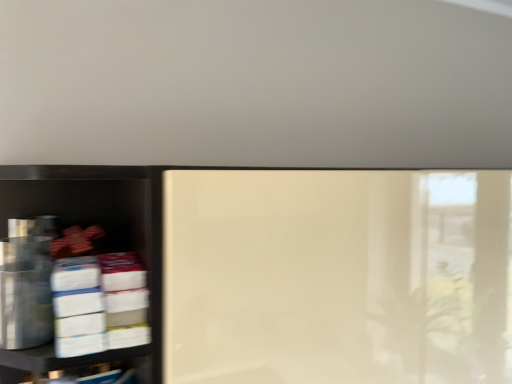
I want to click on metallic silver canisters at left, which is counted as the 1th shelf, starting from the left, so click(x=98, y=215).

Measure the distance between point (139, 195) and camera.

Point (139, 195) is 32.32 inches away from camera.

What do you see at coordinates (98, 215) in the screenshot? The height and width of the screenshot is (384, 512). I see `metallic silver canisters at left, marked as the second shelf in a right-to-left arrangement` at bounding box center [98, 215].

Describe the element at coordinates (324, 274) in the screenshot. I see `matte white shelf at center, which is the first shelf in right-to-left order` at that location.

This screenshot has width=512, height=384. Find the location of `matte white shelf at center, which is the first shelf in right-to-left order`. matte white shelf at center, which is the first shelf in right-to-left order is located at coordinates (324, 274).

The height and width of the screenshot is (384, 512). I want to click on metallic silver canisters at left, which is counted as the 1th shelf, starting from the left, so click(98, 215).

Considering the relative positions of metallic silver canisters at left, marked as the second shelf in a right-to-left arrangement, and matte white shelf at center, the second shelf positioned from the left, in the image provided, is metallic silver canisters at left, marked as the second shelf in a right-to-left arrangement, to the right of matte white shelf at center, the second shelf positioned from the left, from the viewer's perspective?

Incorrect, metallic silver canisters at left, marked as the second shelf in a right-to-left arrangement, is not on the right side of matte white shelf at center, the second shelf positioned from the left.

Is metallic silver canisters at left, which is counted as the 1th shelf, starting from the left, closer to camera compared to matte white shelf at center, which is the first shelf in right-to-left order?

Yes, metallic silver canisters at left, which is counted as the 1th shelf, starting from the left, is closer to the viewer.

Considering the points (50, 206) and (370, 277), which point is behind, point (50, 206) or point (370, 277)?

The point (50, 206) is farther.

From the image's perspective, is metallic silver canisters at left, marked as the second shelf in a right-to-left arrangement, located beneath matte white shelf at center, which is the first shelf in right-to-left order?

No.

From a real-world perspective, is metallic silver canisters at left, marked as the second shelf in a right-to-left arrangement, positioned over matte white shelf at center, which is the first shelf in right-to-left order, based on gravity?

Yes, from a real-world perspective, metallic silver canisters at left, marked as the second shelf in a right-to-left arrangement, is over matte white shelf at center, which is the first shelf in right-to-left order

Can you confirm if metallic silver canisters at left, marked as the second shelf in a right-to-left arrangement, is wider than matte white shelf at center, the second shelf positioned from the left?

Incorrect, the width of metallic silver canisters at left, marked as the second shelf in a right-to-left arrangement, does not surpass that of matte white shelf at center, the second shelf positioned from the left.

Is metallic silver canisters at left, marked as the second shelf in a right-to-left arrangement, taller than matte white shelf at center, the second shelf positioned from the left?

In fact, metallic silver canisters at left, marked as the second shelf in a right-to-left arrangement, may be shorter than matte white shelf at center, the second shelf positioned from the left.

Who is bigger, metallic silver canisters at left, which is counted as the 1th shelf, starting from the left, or matte white shelf at center, the second shelf positioned from the left?

matte white shelf at center, the second shelf positioned from the left.

Is metallic silver canisters at left, marked as the second shelf in a right-to-left arrangement, spatially inside matte white shelf at center, which is the first shelf in right-to-left order, or outside of it?

The correct answer is: outside.

Is metallic silver canisters at left, which is counted as the 1th shelf, starting from the left, with matte white shelf at center, the second shelf positioned from the left?

They are not placed beside each other.

In the scene shown: Is metallic silver canisters at left, marked as the second shelf in a right-to-left arrangement, turned away from matte white shelf at center, which is the first shelf in right-to-left order?

metallic silver canisters at left, marked as the second shelf in a right-to-left arrangement, is not turned away from matte white shelf at center, which is the first shelf in right-to-left order.

Can you tell me how much metallic silver canisters at left, marked as the second shelf in a right-to-left arrangement, and matte white shelf at center, which is the first shelf in right-to-left order, differ in facing direction?

They differ by 1.05 degrees in their facing directions.

In order to click on shelf in front of the matte white shelf at center, the second shelf positioned from the left in this screenshot , I will do `click(98, 215)`.

Which is more to the right, matte white shelf at center, the second shelf positioned from the left, or metallic silver canisters at left, marked as the second shelf in a right-to-left arrangement?

matte white shelf at center, the second shelf positioned from the left, is more to the right.

Relative to metallic silver canisters at left, marked as the second shelf in a right-to-left arrangement, is matte white shelf at center, the second shelf positioned from the left, in front or behind?

matte white shelf at center, the second shelf positioned from the left, is behind metallic silver canisters at left, marked as the second shelf in a right-to-left arrangement.

Which is behind, point (417, 346) or point (141, 173)?

The point (417, 346) is farther from the camera.

From the image's perspective, which is above, matte white shelf at center, which is the first shelf in right-to-left order, or metallic silver canisters at left, marked as the second shelf in a right-to-left arrangement?

metallic silver canisters at left, marked as the second shelf in a right-to-left arrangement, appears higher in the image.

Looking at this image, from a real-world perspective, is matte white shelf at center, which is the first shelf in right-to-left order, beneath metallic silver canisters at left, which is counted as the 1th shelf, starting from the left?

Yes, from a real-world perspective, matte white shelf at center, which is the first shelf in right-to-left order, is under metallic silver canisters at left, which is counted as the 1th shelf, starting from the left.

Considering the relative sizes of matte white shelf at center, which is the first shelf in right-to-left order, and metallic silver canisters at left, marked as the second shelf in a right-to-left arrangement, in the image provided, is matte white shelf at center, which is the first shelf in right-to-left order, wider than metallic silver canisters at left, marked as the second shelf in a right-to-left arrangement,?

→ Indeed, matte white shelf at center, which is the first shelf in right-to-left order, has a greater width compared to metallic silver canisters at left, marked as the second shelf in a right-to-left arrangement.

Is matte white shelf at center, which is the first shelf in right-to-left order, taller than metallic silver canisters at left, marked as the second shelf in a right-to-left arrangement?

Yes.

Considering the sizes of matte white shelf at center, which is the first shelf in right-to-left order, and metallic silver canisters at left, marked as the second shelf in a right-to-left arrangement, in the image, is matte white shelf at center, which is the first shelf in right-to-left order, bigger or smaller than metallic silver canisters at left, marked as the second shelf in a right-to-left arrangement,?

Clearly, matte white shelf at center, which is the first shelf in right-to-left order, is larger in size than metallic silver canisters at left, marked as the second shelf in a right-to-left arrangement.

Is matte white shelf at center, the second shelf positioned from the left, inside the boundaries of metallic silver canisters at left, marked as the second shelf in a right-to-left arrangement, or outside?

matte white shelf at center, the second shelf positioned from the left, is not inside metallic silver canisters at left, marked as the second shelf in a right-to-left arrangement, it's outside.

Is matte white shelf at center, the second shelf positioned from the left, positioned far away from metallic silver canisters at left, which is counted as the 1th shelf, starting from the left?

No.

Is matte white shelf at center, which is the first shelf in right-to-left order, positioned with its back to metallic silver canisters at left, marked as the second shelf in a right-to-left arrangement?

No, metallic silver canisters at left, marked as the second shelf in a right-to-left arrangement, is not at the back of matte white shelf at center, which is the first shelf in right-to-left order.

The image size is (512, 384). What are the coordinates of `shelf that is above the matte white shelf at center, the second shelf positioned from the left (from the image's perspective)` in the screenshot? It's located at (98, 215).

Find the location of a particular element. Image resolution: width=512 pixels, height=384 pixels. shelf below the metallic silver canisters at left, which is counted as the 1th shelf, starting from the left (from the image's perspective) is located at coordinates (324, 274).

In the image, there is a matte white shelf at center, the second shelf positioned from the left. Where is `shelf above it (from the image's perspective)`? shelf above it (from the image's perspective) is located at coordinates tap(98, 215).